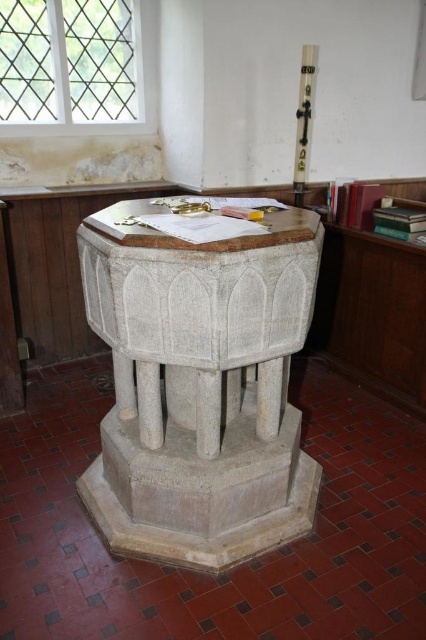
You are standing in the church and want to take a photo of the white stone baptismal font at center. If your camera can focus on objects up to 5 feet away, will you be able to take a clear photo?

The white stone baptismal font at center and camera are 5.22 feet apart from each other. Since the camera can focus up to 5 feet, the distance is slightly beyond its range, so the photo may not be clear.

You are an interior designer planning to place a new decorative item in the church. You have a choice between placing it on the white stone baptismal font at center or the white polished wood cross at upper right. Which surface has a larger width to accommodate a wider item?

The white stone baptismal font at center has a larger width than the white polished wood cross at upper right, so it can accommodate a wider item.

You are a visitor in the church and want to place a small bouquet of flowers between the white stone baptismal font at center and the white polished wood cross at upper right. Given that the bouquet is 2 feet wide, will there be enough space between them to place it without moving either object?

The distance between the white stone baptismal font at center and the white polished wood cross at upper right is 5.29 feet. Since the bouquet is 2 feet wide, there is sufficient space to place it between them without needing to move either object.